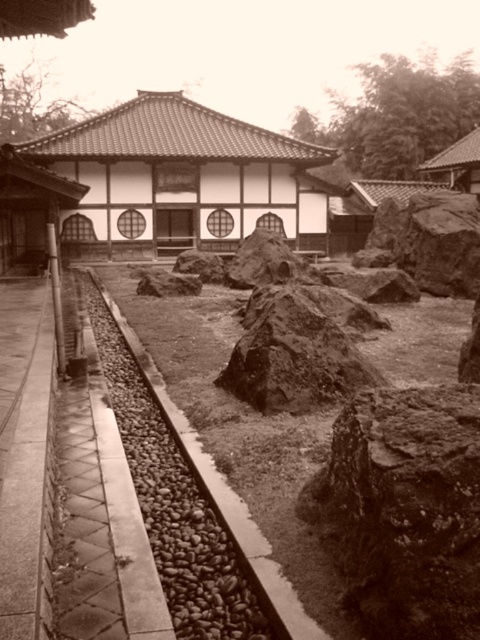
Can you confirm if rusty rock at center is smaller than smooth stone train track at center?

Indeed, rusty rock at center has a smaller size compared to smooth stone train track at center.

Who is positioned more to the left, rusty rock at center or smooth stone train track at center?

smooth stone train track at center

Who is more forward, (336, 426) or (139, 442)?

Point (336, 426) is in front.

Identify the location of rusty rock at center. 405,509.

Is rusty rock at center thinner than rustic brown rock at center?

Yes, rusty rock at center is thinner than rustic brown rock at center.

Looking at this image, who is more forward, (370,428) or (247,332)?

Point (370,428) is more forward.

Which is in front, point (373, 540) or point (276, 410)?

Positioned in front is point (373, 540).

The image size is (480, 640). Find the location of `rusty rock at center`. rusty rock at center is located at coordinates (405, 509).

Can you confirm if smooth stone train track at center is bigger than rustic brown rock at center?

Yes.

The image size is (480, 640). Identify the location of smooth stone train track at center. (179, 506).